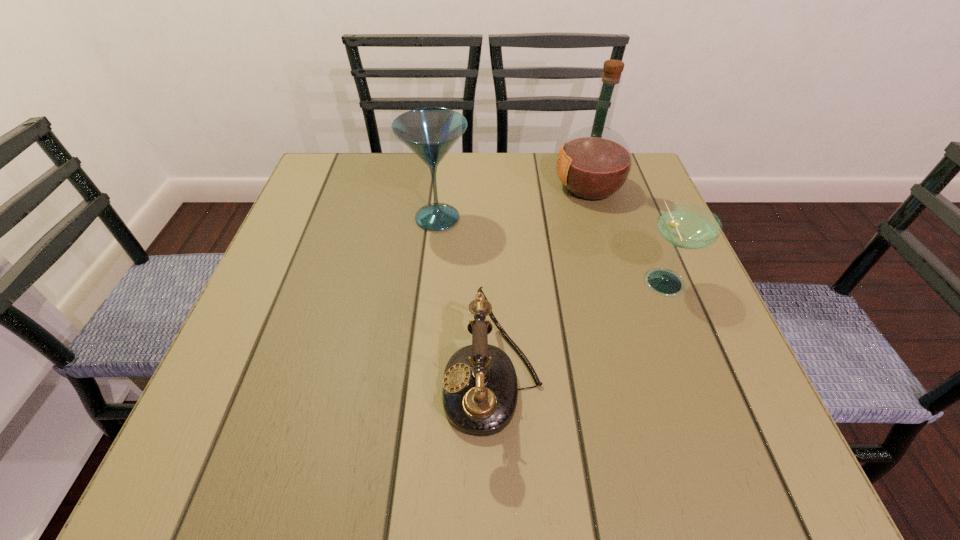
This screenshot has height=540, width=960. In order to click on vacant space in between the left martini and the liquor in this screenshot , I will do `click(513, 202)`.

Find the location of a particular element. The height and width of the screenshot is (540, 960). free space between the farther martini and the liquor is located at coordinates (513, 202).

The height and width of the screenshot is (540, 960). I want to click on free space between the second nearest object and the telephone, so click(578, 332).

Where is `free space between the telephone and the taller martini`? Image resolution: width=960 pixels, height=540 pixels. free space between the telephone and the taller martini is located at coordinates (466, 300).

Where is `free spot between the telephone and the tallest object`? free spot between the telephone and the tallest object is located at coordinates coord(540,285).

In order to click on vacant area that lies between the telephone and the liquor in this screenshot , I will do `click(540, 285)`.

This screenshot has height=540, width=960. Identify the location of vacant area between the nearest object and the shorter martini. (578, 332).

In order to click on object identified as the third closest to the liquor in this screenshot , I will do `click(480, 391)`.

Identify which object is the third nearest to the liquor. Please provide its 2D coordinates. Your answer should be formatted as a tuple, i.e. [(x, y)], where the tuple contains the x and y coordinates of a point satisfying the conditions above.

[(480, 391)]

The width and height of the screenshot is (960, 540). Identify the location of vacant position in the image that satisfies the following two spatial constraints: 1. on the front label of the tallest object; 2. on the back side of the right martini. (616, 280).